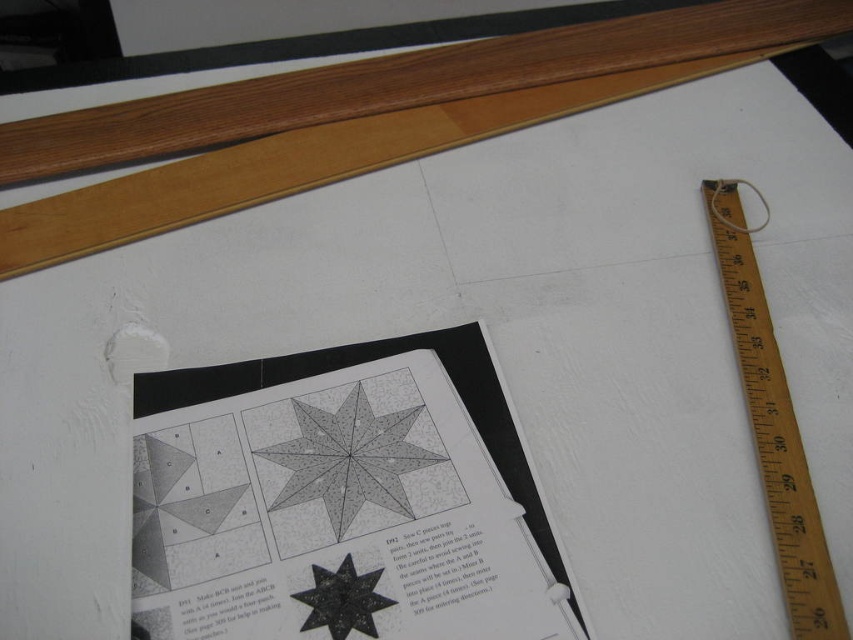
You are working on a quilt project and need to measure the gray dotted star at center. You have the wooden ruler at right. Can you use the ruler to measure the star without moving either object?

The wooden ruler at right is to the right of the gray dotted star at center, so it cannot reach the star to measure it without moving either object.

You are a craftsperson working on a project and need to take a photo of the gray paper at center. Your camera is positioned at the edge of the table. The camera has a minimum focusing distance of 30 inches. Can you take a clear photo without moving the camera or the paper?

The gray paper at center and camera are 31.00 inches apart from each other. Since the minimum focusing distance is 30 inches, the camera can focus clearly at 31 inches. Therefore, you can take a clear photo without moving the camera or the paper.